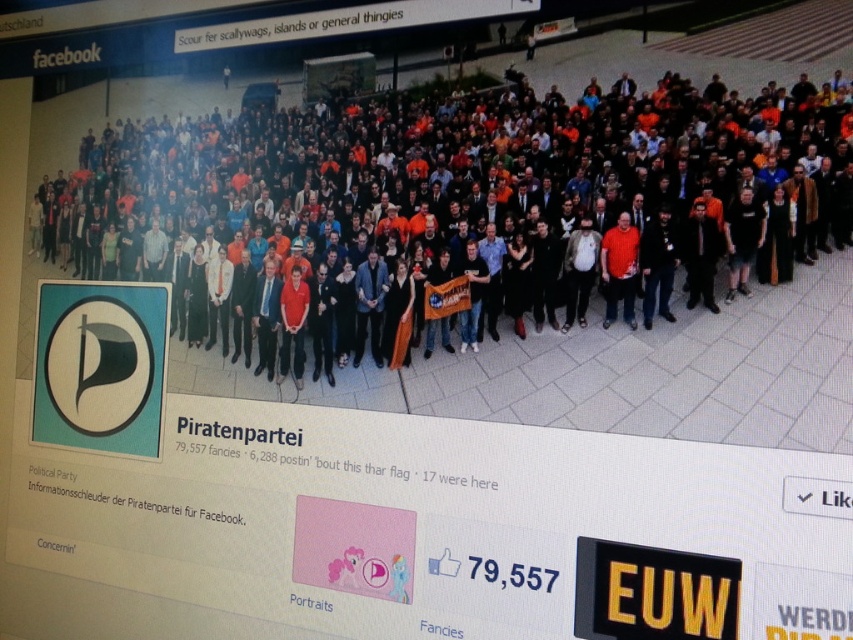
Based on the scene described, which object takes up more horizontal space in the image? The multicolored casual attire at center or the black text at upper center?

The multicolored casual attire at center takes up more horizontal space than the black text at upper center because its width is larger according to the description.

You are a graphic designer reviewing this image for the German Pirate Party. You need to determine if the matte orange shirt at center and the black text at upper center are positioned correctly according to design guidelines. Specifically, which object is closer to the viewer in the image?

The matte orange shirt at center is closer to the viewer than the black text at upper center, so according to the description, the shirt is positioned in front of the text.

You are a graphic designer reviewing this Facebook post for the German Pirate Party. You need to determine if the matte orange shirt at center and the black text at upper center are appropriately sized for readability and visibility. Based on the image, which object is smaller in size?

The matte orange shirt at center has a smaller size compared to the black text at upper center, so the matte orange shirt at center is smaller.